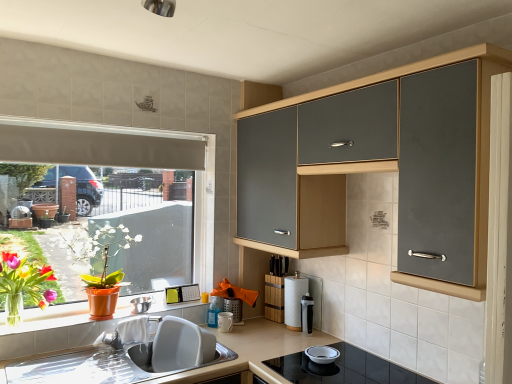
This screenshot has width=512, height=384. I want to click on free space above beige matte countertop at lower center (from a real-world perspective), so click(x=257, y=352).